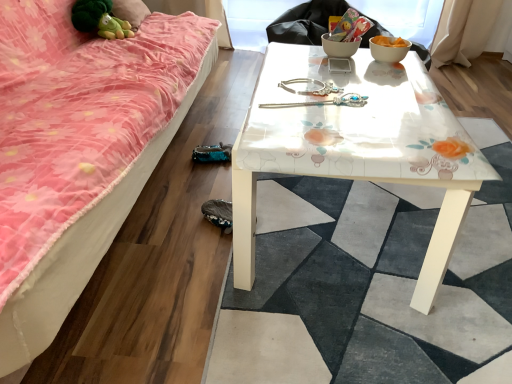
Locate an element on the screen. The image size is (512, 384). free space to the right of silver metallic hairpin at center is located at coordinates (384, 105).